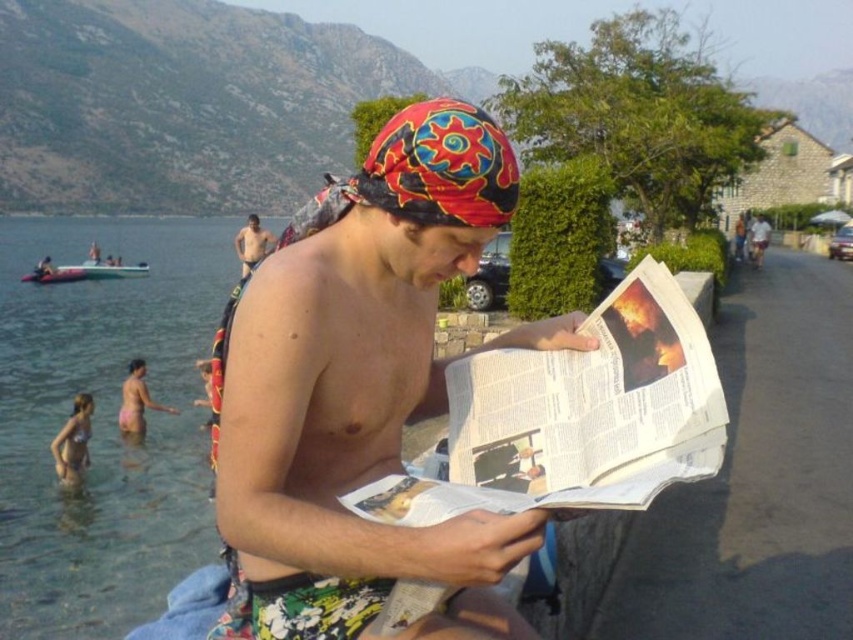
Question: Considering the real-world distances, which object is farthest from the white paper at center?

Choices:
 (A) matte black skin at center
 (B) pink fabric bikini at lower left
 (C) clear water at lower left

Answer: (A)

Question: Can you confirm if pink fabric bikini at lower left is positioned to the right of matte black skin at center?

Choices:
 (A) yes
 (B) no

Answer: (A)

Question: Which is farther from the beige bikini at lower left?

Choices:
 (A) multicolored fabric headscarf at center
 (B) white paper at center
 (C) matte black skin at center

Answer: (C)

Question: Where is clear water at lower left located in relation to beige bikini at lower left in the image?

Choices:
 (A) above
 (B) below

Answer: (A)

Question: Is beige bikini at lower left thinner than pink fabric bikini at lower left?

Choices:
 (A) yes
 (B) no

Answer: (A)

Question: Which object appears farthest from the camera in this image?

Choices:
 (A) beige bikini at lower left
 (B) clear water at lower left

Answer: (A)